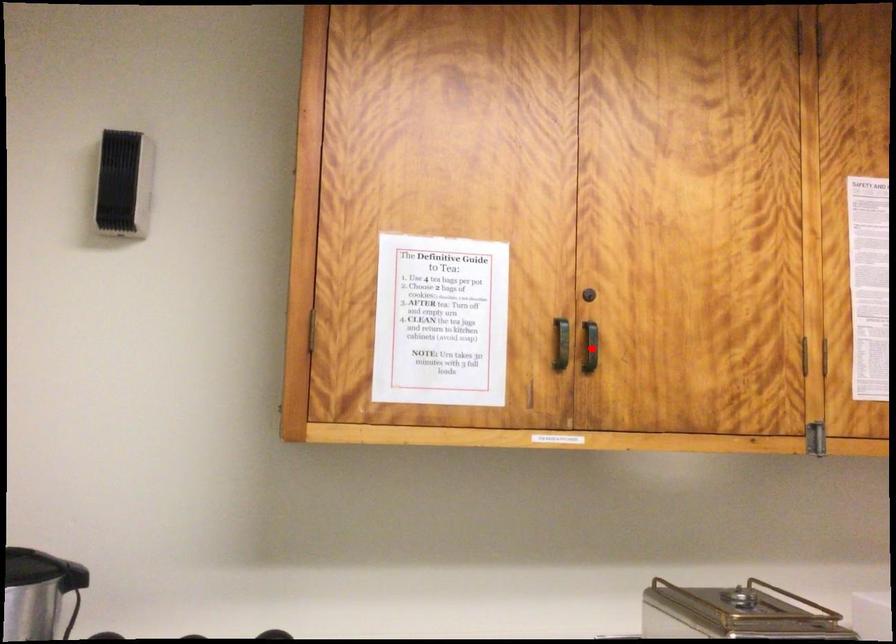
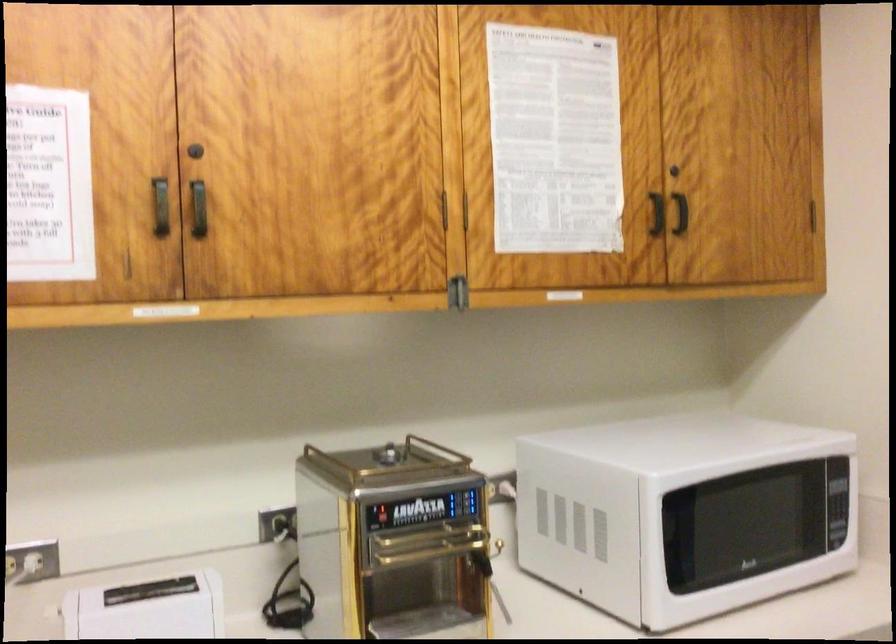
Question: I am providing you with two images of the same scene from different viewpoints. Image1 has a red point marked. In image2, the corresponding 3D location appears at what relative position? Reply with the corresponding letter.

Choices:
 (A) Closer
 (B) Farther

Answer: (A)